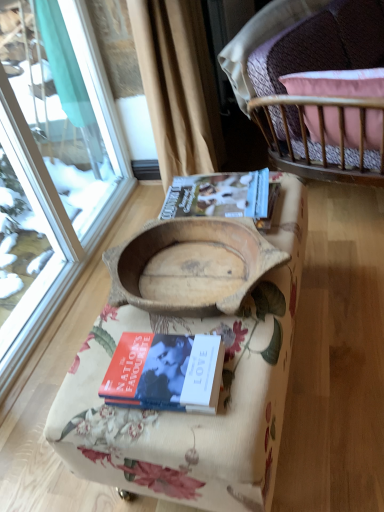
What are the coordinates of `free space behind hardcover book at center, marked as the 2th book in a top-to-bottom arrangement` in the screenshot? It's located at (149, 319).